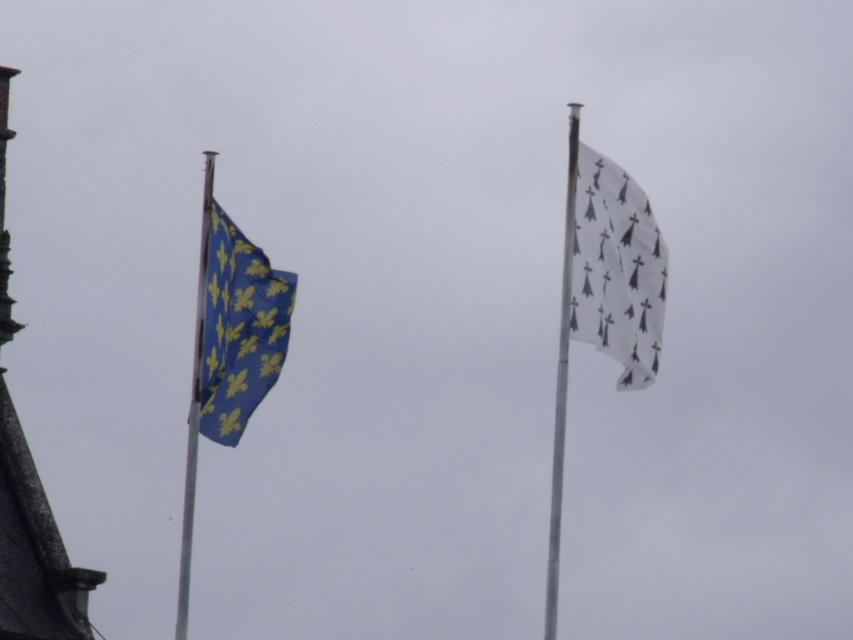
Question: Is the position of white matte flag at upper right less distant than that of metallic silver flag pole at left?

Choices:
 (A) yes
 (B) no

Answer: (B)

Question: Observing the image, what is the correct spatial positioning of white matte flag at upper right in reference to smooth stone tower at left?

Choices:
 (A) above
 (B) below

Answer: (A)

Question: Which object is positioned farthest from the rusty metal flag pole at right?

Choices:
 (A) smooth stone tower at left
 (B) metallic silver flag pole at left

Answer: (A)

Question: Among these objects, which one is nearest to the camera?

Choices:
 (A) rusty metal flag pole at right
 (B) white matte flag at upper right

Answer: (B)

Question: Which object is the farthest from the metallic silver flag pole at left?

Choices:
 (A) rusty metal flag pole at right
 (B) smooth stone tower at left

Answer: (A)

Question: Can you confirm if blue fabric flag at left is positioned to the left of metallic silver flag pole at left?

Choices:
 (A) yes
 (B) no

Answer: (B)